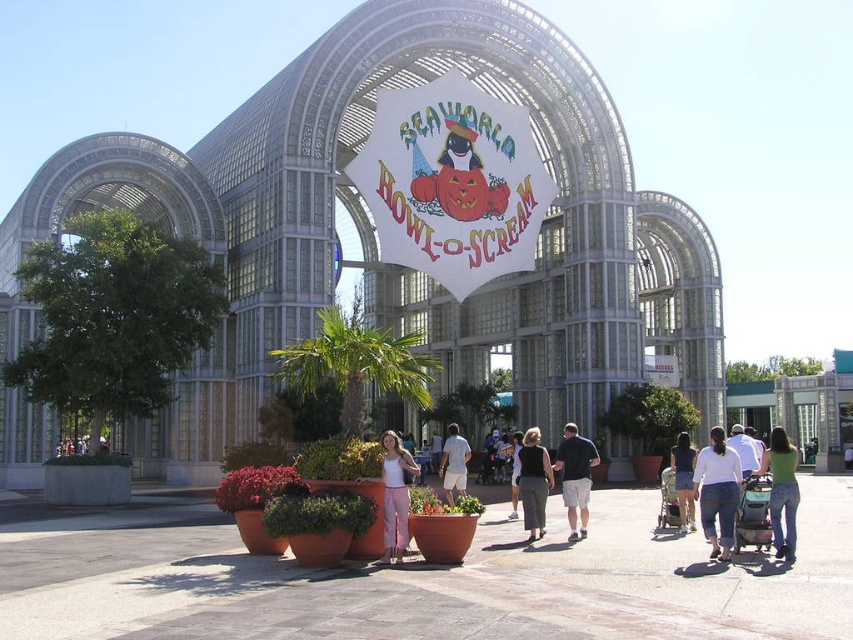
Question: Among these points, which one is farthest from the camera?

Choices:
 (A) (682, 525)
 (B) (453, 436)
 (C) (416, 468)

Answer: (B)

Question: Can you confirm if dark blue shirt at center is positioned above white cotton shirt at center?

Choices:
 (A) yes
 (B) no

Answer: (A)

Question: Is matte white tank top at center bigger than dark blue shirt at center?

Choices:
 (A) no
 (B) yes

Answer: (A)

Question: Which point is farther from the camera taking this photo?

Choices:
 (A) (723, 536)
 (B) (512, 477)
 (C) (540, 449)
 (D) (583, 456)

Answer: (B)

Question: Does dark blue shirt at center have a smaller size compared to white cotton shirt at center?

Choices:
 (A) no
 (B) yes

Answer: (A)

Question: Which of the following is the closest to the observer?

Choices:
 (A) (509, 448)
 (B) (440, 476)
 (C) (573, 268)

Answer: (A)